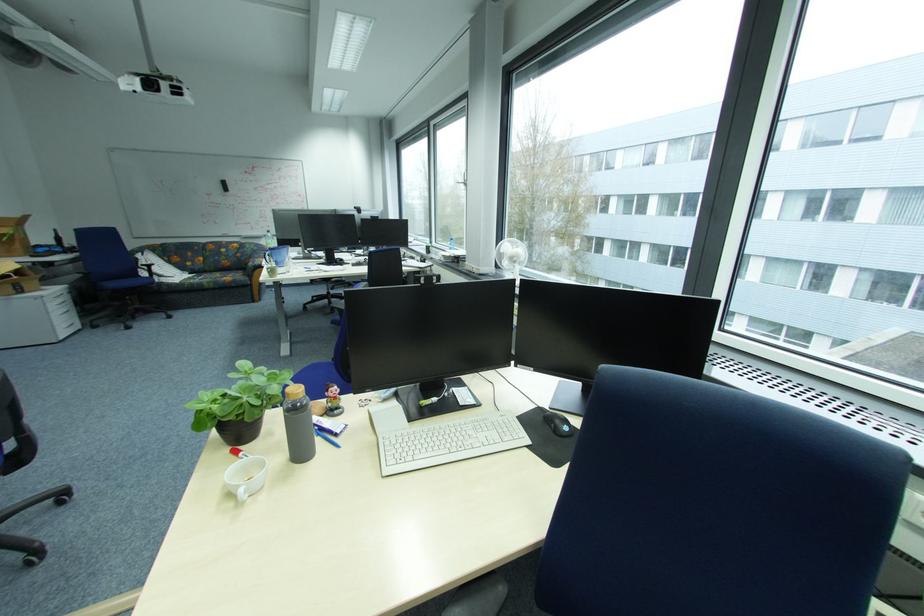
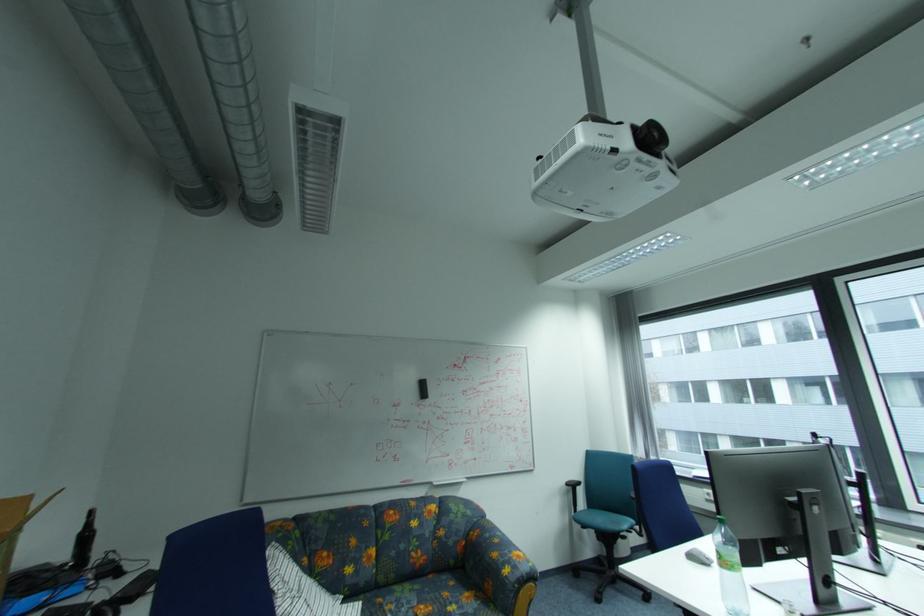
Locate, in the second image, the point that corresponds to point 228,187 in the first image.

(423, 391)